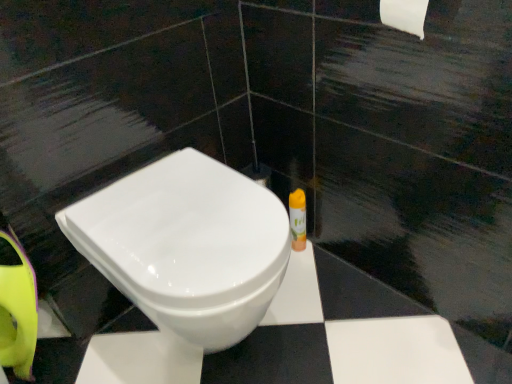
This screenshot has height=384, width=512. In order to click on free point above white glossy toilet at center (from a real-world perspective) in this screenshot , I will do `click(179, 215)`.